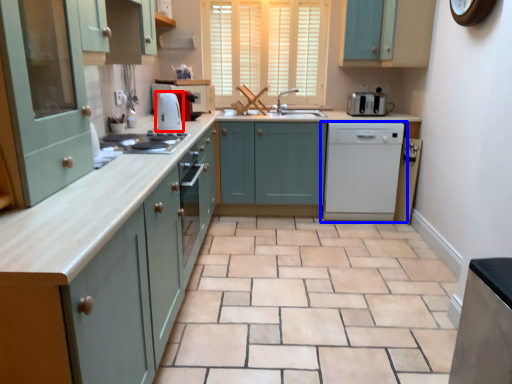
Question: Which of the following is the farthest to the observer, kitchen appliance (highlighted by a red box) or home appliance (highlighted by a blue box)?

Choices:
 (A) kitchen appliance
 (B) home appliance

Answer: (B)